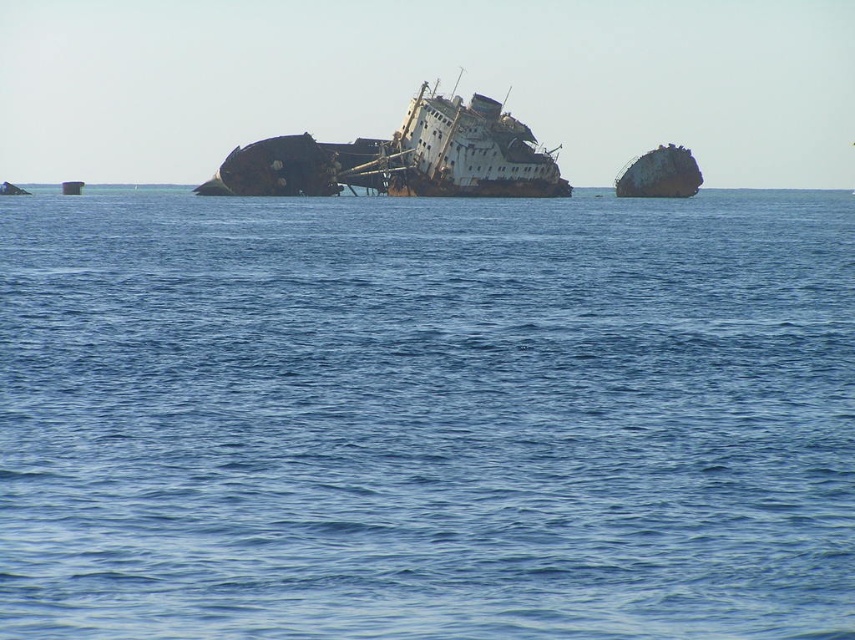
Does rusty metal shipwreck at center have a lesser height compared to rusty metal shipwreck at right?

No, rusty metal shipwreck at center is not shorter than rusty metal shipwreck at right.

Does rusty metal shipwreck at center come behind rusty metal shipwreck at right?

No.

Which is in front, point (490, 189) or point (682, 156)?

Positioned in front is point (490, 189).

This screenshot has height=640, width=855. In order to click on rusty metal shipwreck at center in this screenshot , I will do [x=404, y=157].

Between blue water at center and rusty metal shipwreck at right, which one appears on the right side from the viewer's perspective?

rusty metal shipwreck at right

Is blue water at center smaller than rusty metal shipwreck at right?

No.

Find the location of a particular element. Image resolution: width=855 pixels, height=640 pixels. blue water at center is located at coordinates (426, 417).

I want to click on blue water at center, so click(426, 417).

Is point (550, 540) farther from camera compared to point (417, 177)?

No, (550, 540) is in front of (417, 177).

Is blue water at center further to camera compared to rusty metal shipwreck at center?

No, blue water at center is closer to the viewer.

Who is more distant from viewer, [38,250] or [301,157]?

The point [301,157] is behind.

I want to click on blue water at center, so click(x=426, y=417).